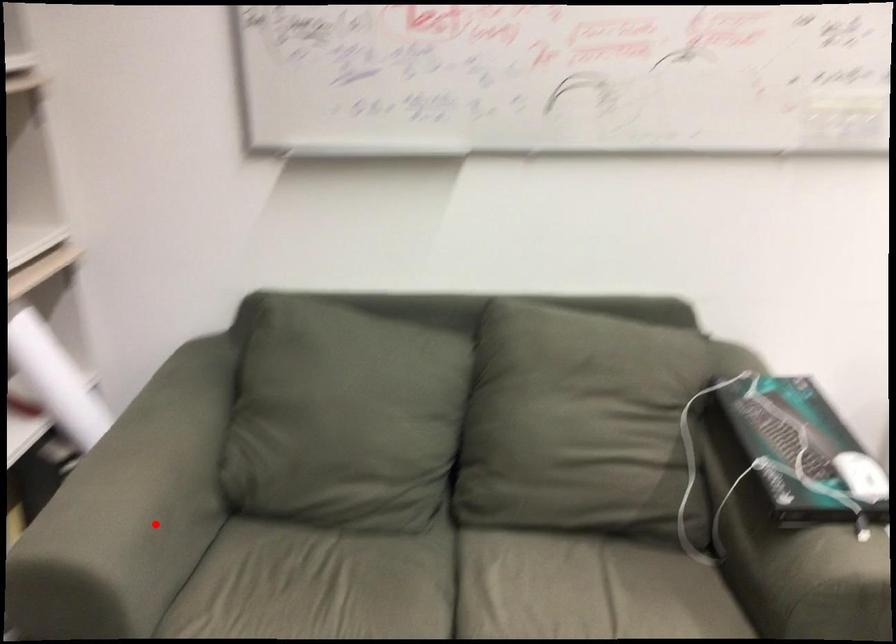
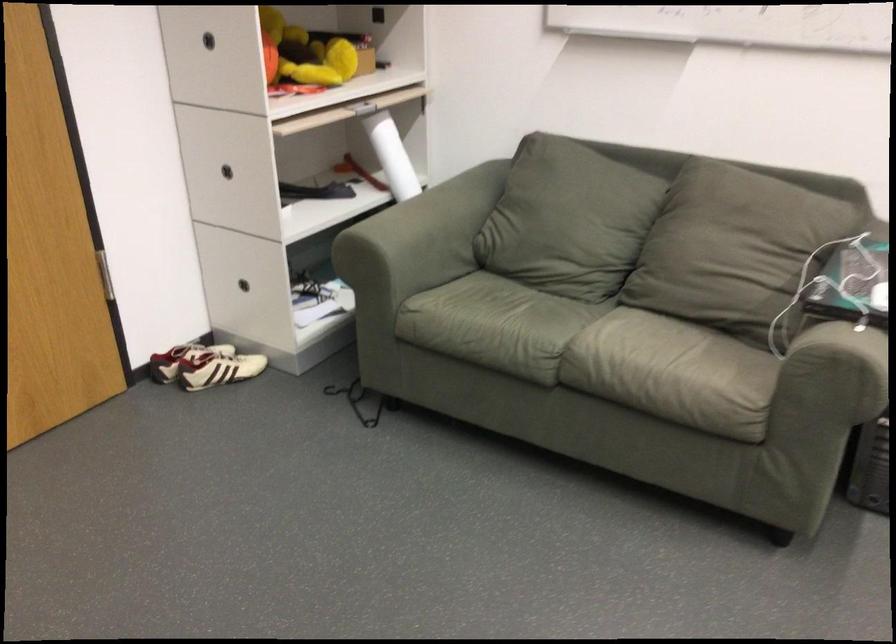
Where in the second image is the point corresponding to the highlighted location from the first image?

(416, 242)